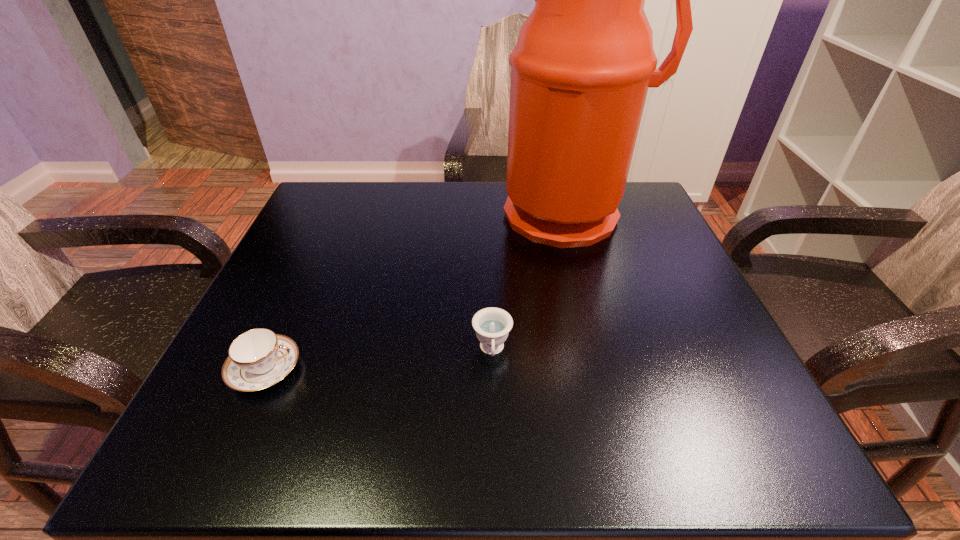
In the image, there is a desktop. Identify the location of vacant space at the far edge. (442, 211).

Locate an element on the screen. The image size is (960, 540). vacant space at the near edge of the desktop is located at coordinates (312, 413).

Identify the location of vacant point at the left edge. The width and height of the screenshot is (960, 540). (302, 388).

Locate an element on the screen. Image resolution: width=960 pixels, height=540 pixels. vacant space at the right edge of the desktop is located at coordinates (671, 364).

Find the location of `free space at the far left corner of the desktop`. free space at the far left corner of the desktop is located at coordinates (365, 206).

In the image, there is a desktop. At what (x,y) coordinates should I click in order to perform the action: click on vacant space at the near left corner. Please return your answer as a coordinate pair (x, y). The height and width of the screenshot is (540, 960). Looking at the image, I should click on (265, 451).

In the image, there is a desktop. At what (x,y) coordinates should I click in order to perform the action: click on vacant space at the far right corner. Please return your answer as a coordinate pair (x, y). This screenshot has width=960, height=540. Looking at the image, I should click on (641, 190).

The image size is (960, 540). Identify the location of vacant space at the near right corner of the desktop. [684, 424].

The image size is (960, 540). What are the coordinates of `vacant space that's between the water jug and the right teacup` in the screenshot? It's located at (531, 282).

The width and height of the screenshot is (960, 540). What are the coordinates of `unoccupied position between the left teacup and the tallest object` in the screenshot? It's located at (418, 292).